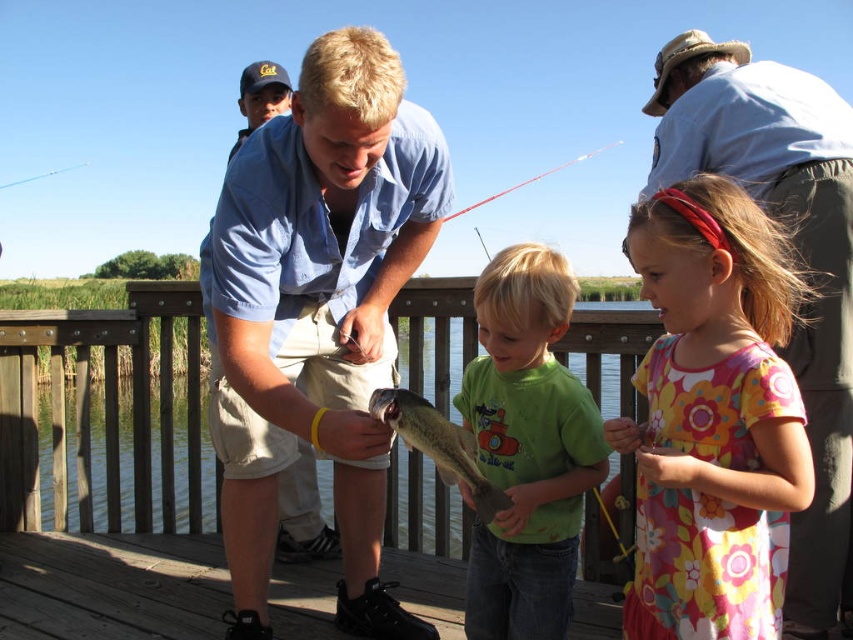
Question: Is red fiberglass rod at upper center wider than clear plastic rod at upper left?

Choices:
 (A) yes
 (B) no

Answer: (A)

Question: Which object appears closest to the camera in this image?

Choices:
 (A) shiny silver fish at center
 (B) red fiberglass rod at upper center

Answer: (A)

Question: Which object appears closest to the camera in this image?

Choices:
 (A) floral cotton dress at center
 (B) green matte shirt at center

Answer: (A)

Question: Is matte blue shirt at center behind floral cotton dress at center?

Choices:
 (A) yes
 (B) no

Answer: (A)

Question: Which of the following is the closest to the observer?

Choices:
 (A) green matte shirt at center
 (B) red fiberglass rod at upper center
 (C) matte blue shirt at center
 (D) floral cotton dress at center

Answer: (D)

Question: Does floral cotton dress at center appear under clear plastic rod at upper left?

Choices:
 (A) yes
 (B) no

Answer: (A)